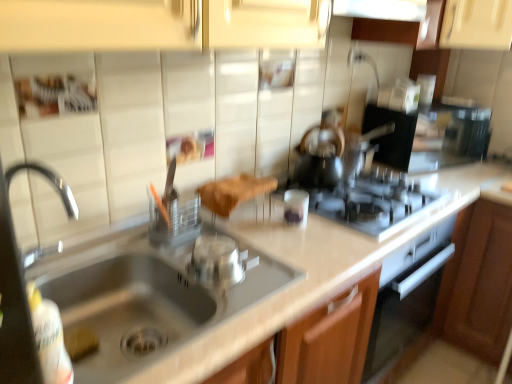
At what (x,y) coordinates should I click in order to perform the action: click on vacant space behind silver metallic pot at center, placed as the 1th appliance when sorted from front to back. Please return your answer as a coordinate pair (x, y). The height and width of the screenshot is (384, 512). Looking at the image, I should click on (228, 245).